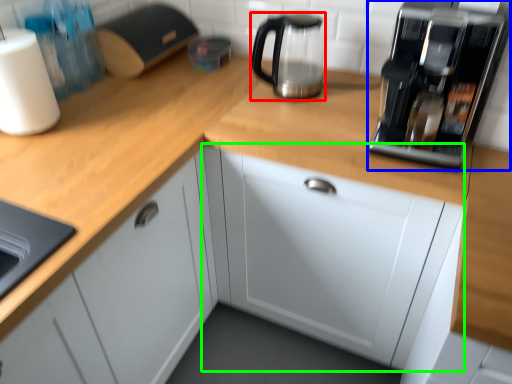
Question: Which is farther away from kitchen appliance (highlighted by a red box)? home appliance (highlighted by a blue box) or cabinetry (highlighted by a green box)?

Choices:
 (A) home appliance
 (B) cabinetry

Answer: (B)